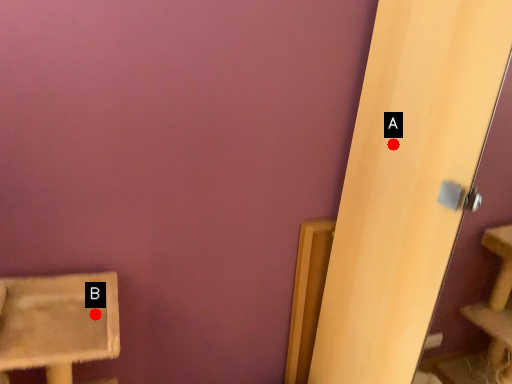
Question: Two points are circled on the image, labeled by A and B beside each circle. Among these points, which one is nearest to the camera?

Choices:
 (A) A is closer
 (B) B is closer

Answer: (B)